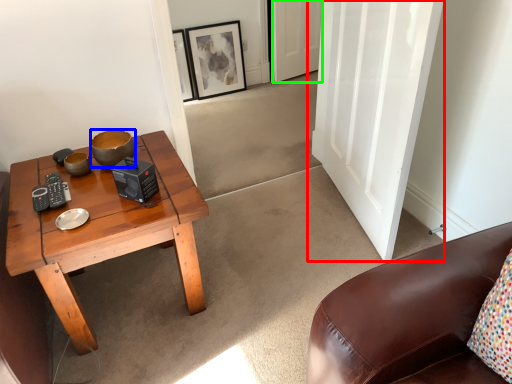
Question: Considering the real-world distances, which object is closest to door (highlighted by a red box)? bowl (highlighted by a blue box) or door (highlighted by a green box).

Choices:
 (A) bowl
 (B) door

Answer: (A)